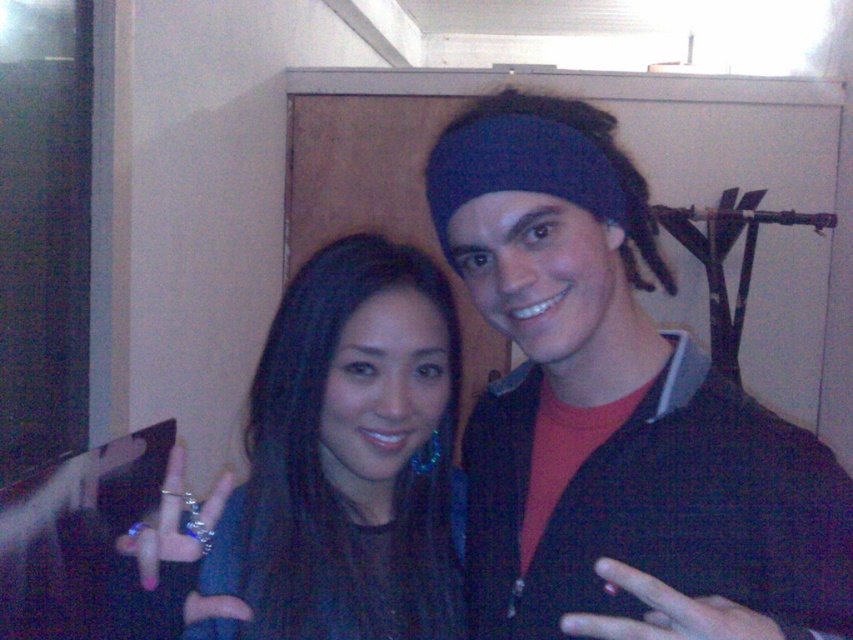
Question: Can you confirm if matte black hair at center is bigger than satin black hair at center?

Choices:
 (A) yes
 (B) no

Answer: (A)

Question: Does matte black hair at center appear over satin black hair at center?

Choices:
 (A) no
 (B) yes

Answer: (B)

Question: Which point appears farthest from the camera in this image?

Choices:
 (A) (397, 493)
 (B) (589, 588)

Answer: (A)

Question: Where is matte black hair at center located in relation to satin black hair at center in the image?

Choices:
 (A) right
 (B) left

Answer: (A)